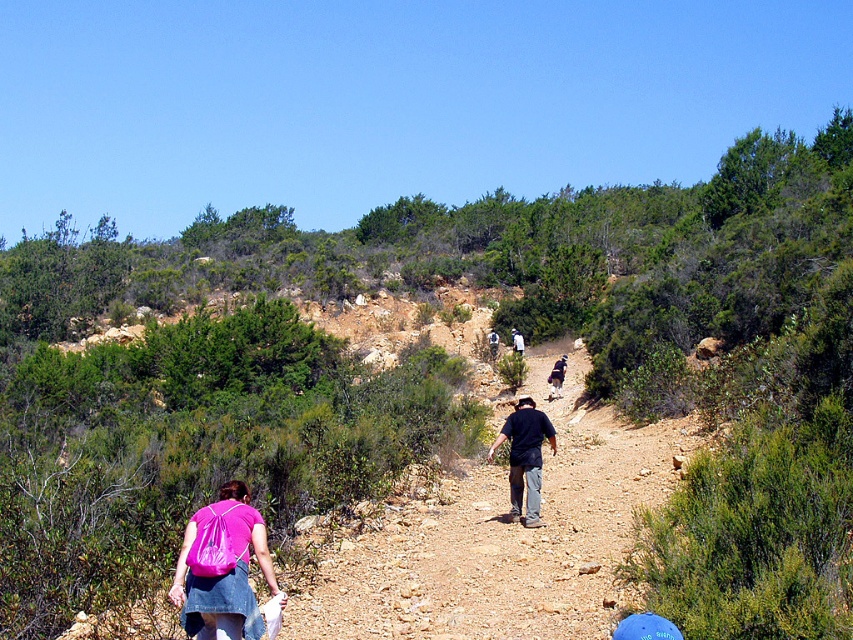
Is pink fabric backpack at lower left smaller than dark blue shirt at center?

Yes, pink fabric backpack at lower left is smaller than dark blue shirt at center.

Can you confirm if pink fabric backpack at lower left is taller than dark blue shirt at center?

No, pink fabric backpack at lower left is not taller than dark blue shirt at center.

Find the location of a particular element. pink fabric backpack at lower left is located at coordinates (222, 568).

Where is `pink fabric backpack at lower left`? pink fabric backpack at lower left is located at coordinates tap(222, 568).